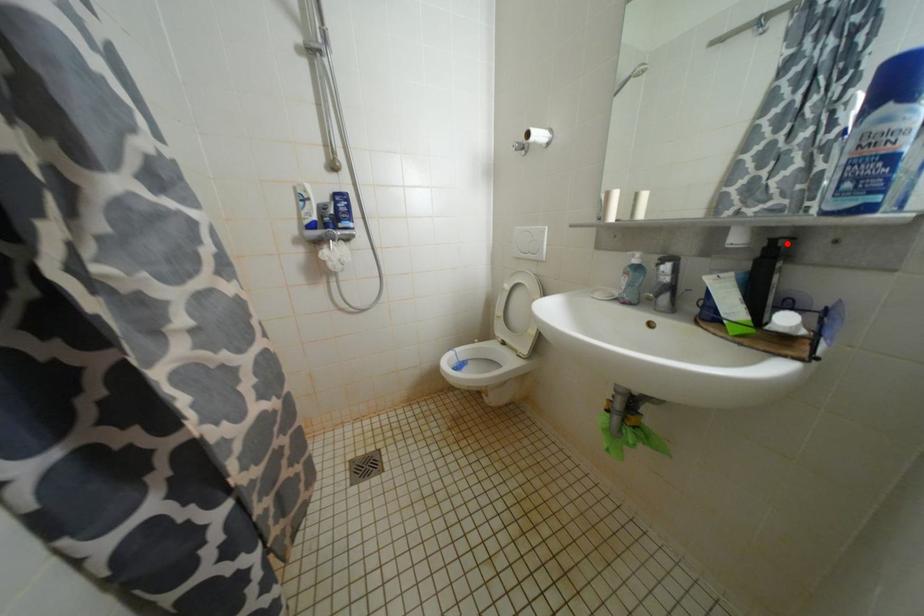
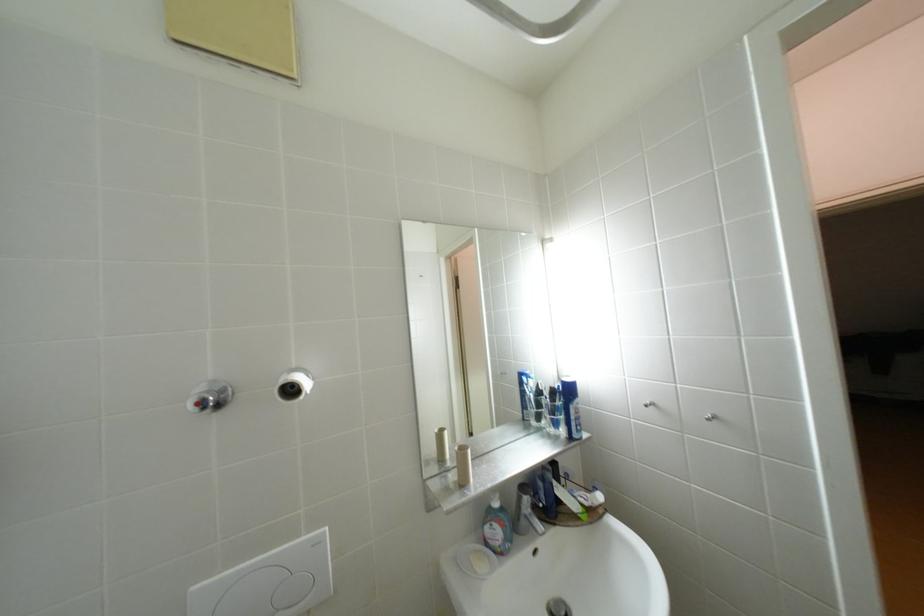
Question: I am providing you with two images of the same scene from different viewpoints. A red point is marked on the first image. Is the red point's position out of view in image 2?

Choices:
 (A) Yes
 (B) No

Answer: (A)